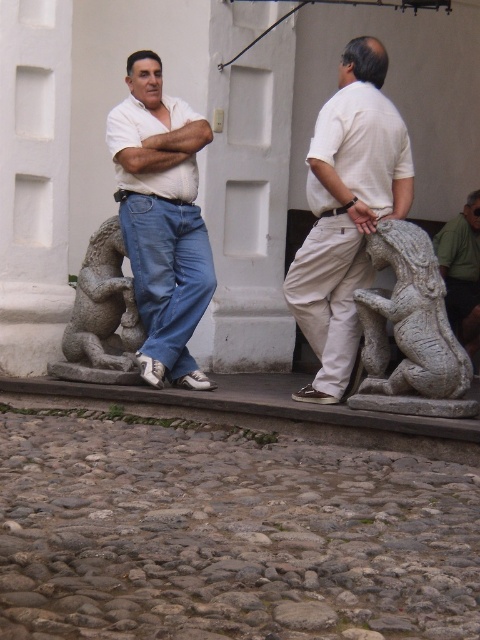
In the scene shown: Can you confirm if khaki pants at center is wider than smooth gray stone statue at right?

Correct, the width of khaki pants at center exceeds that of smooth gray stone statue at right.

Locate an element on the screen. khaki pants at center is located at coordinates pyautogui.click(x=347, y=211).

Is point (374, 108) more distant than point (456, 332)?

No, it is in front of (456, 332).

Locate an element on the screen. This screenshot has width=480, height=640. khaki pants at center is located at coordinates (347, 211).

Can you confirm if khaki pants at center is smaller than matte white shirt at center?

No.

What do you see at coordinates (347, 211) in the screenshot? I see `khaki pants at center` at bounding box center [347, 211].

The image size is (480, 640). Find the location of `khaki pants at center`. khaki pants at center is located at coordinates (347, 211).

Which is above, khaki pants at center or granite lion at left?

khaki pants at center is higher up.

Between khaki pants at center and granite lion at left, which one has less height?

granite lion at left is shorter.

Does point (333, 356) come in front of point (131, 371)?

Yes, point (333, 356) is in front of point (131, 371).

Where is `khaki pants at center`? The height and width of the screenshot is (640, 480). khaki pants at center is located at coordinates (347, 211).